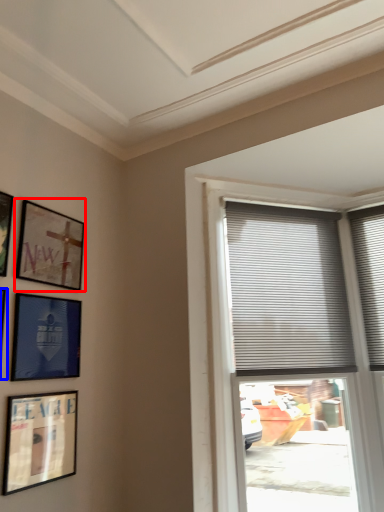
Question: Which point is closer to the camera, picture frame (highlighted by a red box) or picture frame (highlighted by a blue box)?

Choices:
 (A) picture frame
 (B) picture frame

Answer: (B)